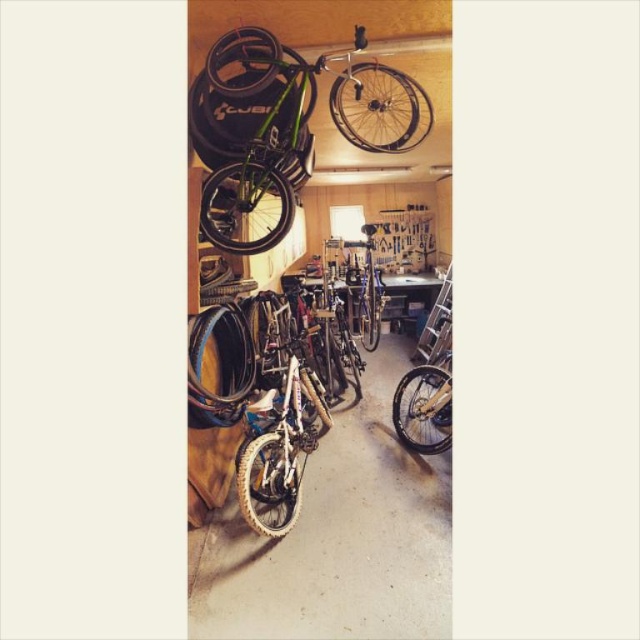
How much distance is there between yellow rubber tire at lower right and black rubber tire at upper center?

yellow rubber tire at lower right is 5.67 feet away from black rubber tire at upper center.

Between yellow rubber tire at lower right and black rubber tire at upper center, which one is positioned higher?

black rubber tire at upper center

Is point (436, 394) positioned behind point (209, 81)?

Yes, point (436, 394) is behind point (209, 81).

The height and width of the screenshot is (640, 640). Find the location of `yellow rubber tire at lower right`. yellow rubber tire at lower right is located at coordinates (422, 410).

Is point (397, 106) positioned before point (224, 221)?

That is False.

Image resolution: width=640 pixels, height=640 pixels. What are the coordinates of `shiny silver rim at upper center` in the screenshot? It's located at (376, 108).

Measure the distance from shiny silver rim at upper center to white rubber tire at center.

shiny silver rim at upper center and white rubber tire at center are 3.88 feet apart.

Is point (372, 109) in front of point (272, 449)?

Yes, point (372, 109) is closer to viewer.

The image size is (640, 640). Describe the element at coordinates (376, 108) in the screenshot. I see `shiny silver rim at upper center` at that location.

Locate an element on the screen. The image size is (640, 640). shiny silver rim at upper center is located at coordinates (376, 108).